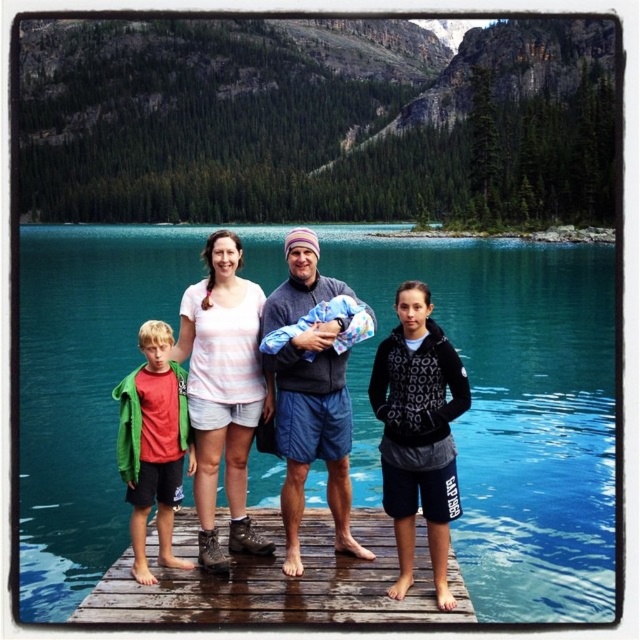
Which is in front, point (435, 568) or point (132, 496)?

Point (435, 568) is in front.

Is the position of matte white shirt at center less distant than that of red cotton shirt at left?

Yes, it is in front of red cotton shirt at left.

Does point (332, 451) come closer to viewer compared to point (161, 413)?

No, (332, 451) is behind (161, 413).

You are a GUI agent. You are given a task and a screenshot of the screen. Output one action in this format:
    pyautogui.click(x=<x>, y=<y>)
    Task: Click on the matte white shirt at center
    The width and height of the screenshot is (640, 640).
    Given the screenshot: What is the action you would take?
    coord(312,429)

Is matte white shirt at center to the left of brown wooden dock at center from the viewer's perspective?

In fact, matte white shirt at center is to the right of brown wooden dock at center.

Does matte white shirt at center have a larger size compared to brown wooden dock at center?

Correct, matte white shirt at center is larger in size than brown wooden dock at center.

At what (x,y) coordinates should I click in order to perform the action: click on matte white shirt at center. Please return your answer as a coordinate pair (x, y). The image size is (640, 640). Looking at the image, I should click on (312, 429).

Where is `matte white shirt at center`? Image resolution: width=640 pixels, height=640 pixels. matte white shirt at center is located at coordinates (312, 429).

Does matte white shirt at center appear on the right side of black hoodie at center?

No, matte white shirt at center is not to the right of black hoodie at center.

Can you confirm if matte white shirt at center is shorter than black hoodie at center?

Incorrect, matte white shirt at center's height does not fall short of black hoodie at center's.

Where is `matte white shirt at center`? Image resolution: width=640 pixels, height=640 pixels. matte white shirt at center is located at coordinates (312, 429).